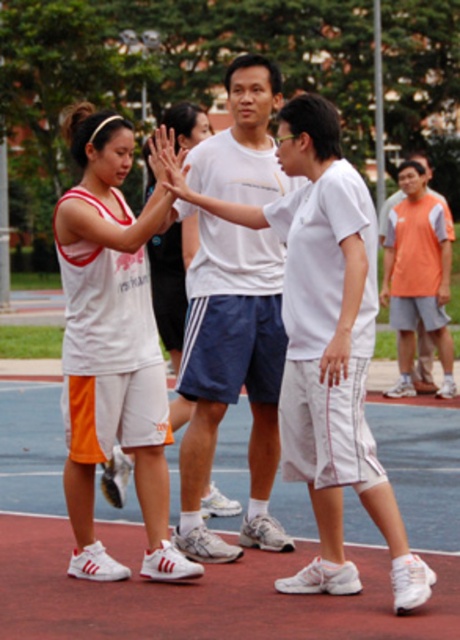
Is white synthetic court at center shorter than white matte t-shirt at center?

Correct, white synthetic court at center is not as tall as white matte t-shirt at center.

Which of these two, white synthetic court at center or white matte t-shirt at center, stands shorter?

Standing shorter between the two is white synthetic court at center.

What do you see at coordinates (218, 564) in the screenshot? This screenshot has height=640, width=460. I see `white synthetic court at center` at bounding box center [218, 564].

You are a GUI agent. You are given a task and a screenshot of the screen. Output one action in this format:
    pyautogui.click(x=<x>, y=<y>)
    Task: Click on the white synthetic court at center
    Image resolution: width=460 pixels, height=640 pixels.
    Given the screenshot: What is the action you would take?
    (x=218, y=564)

Who is positioned more to the left, white synthetic court at center or orange fabric shirt at upper right?

From the viewer's perspective, white synthetic court at center appears more on the left side.

This screenshot has height=640, width=460. Find the location of `white synthetic court at center`. white synthetic court at center is located at coordinates (218, 564).

You are a GUI agent. You are given a task and a screenshot of the screen. Output one action in this format:
    pyautogui.click(x=<x>, y=<y>)
    Task: Click on the white synthetic court at center
    The width and height of the screenshot is (460, 640).
    Given the screenshot: What is the action you would take?
    pyautogui.click(x=218, y=564)

How distant is white matte t-shirt at center from orange fabric shirt at upper right?

white matte t-shirt at center and orange fabric shirt at upper right are 5.47 meters apart from each other.

You are a GUI agent. You are given a task and a screenshot of the screen. Output one action in this format:
    pyautogui.click(x=<x>, y=<y>)
    Task: Click on the white matte t-shirt at center
    
    Given the screenshot: What is the action you would take?
    pyautogui.click(x=231, y=376)